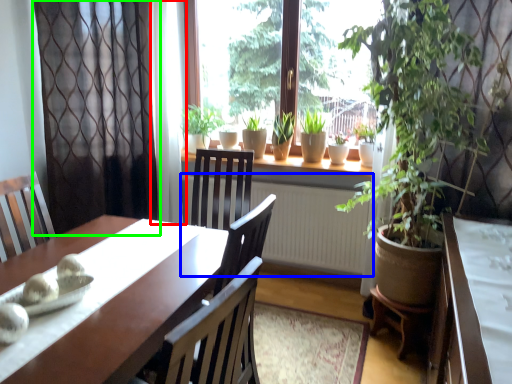
Question: Based on their relative distances, which object is farther from curtain (highlighted by a red box)? Choose from radiator (highlighted by a blue box) and curtain (highlighted by a green box).

Choices:
 (A) radiator
 (B) curtain

Answer: (A)